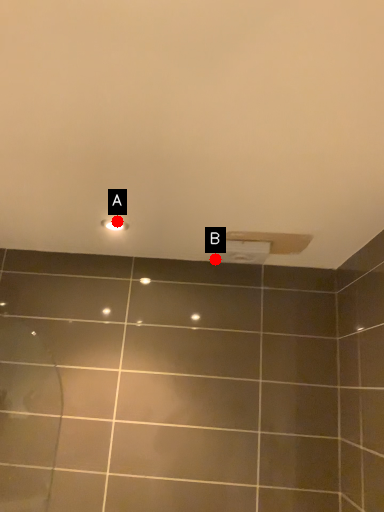
Question: Two points are circled on the image, labeled by A and B beside each circle. Which point is further to the camera?

Choices:
 (A) A is further
 (B) B is further

Answer: (B)